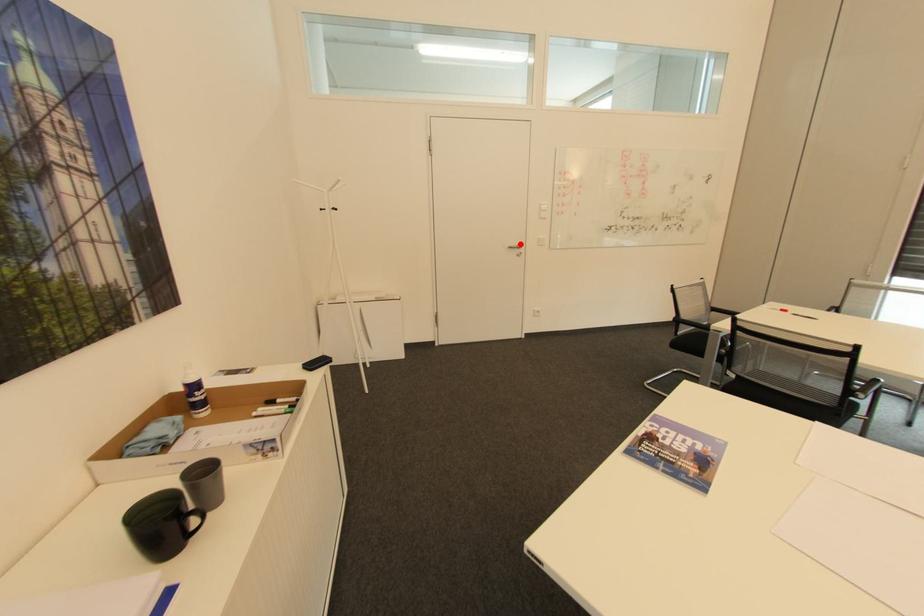
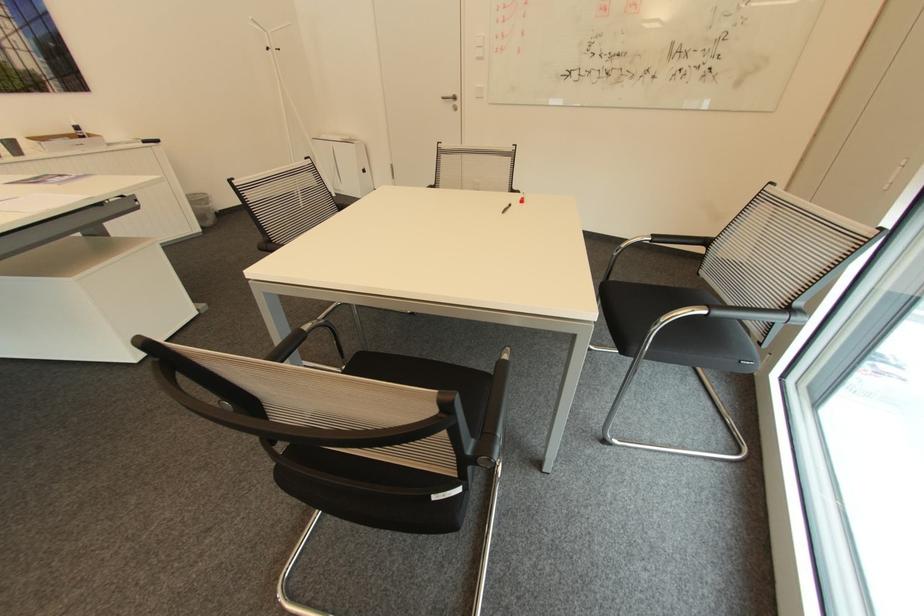
In the second image, find the point that corresponds to the highlighted location in the first image.

(456, 95)